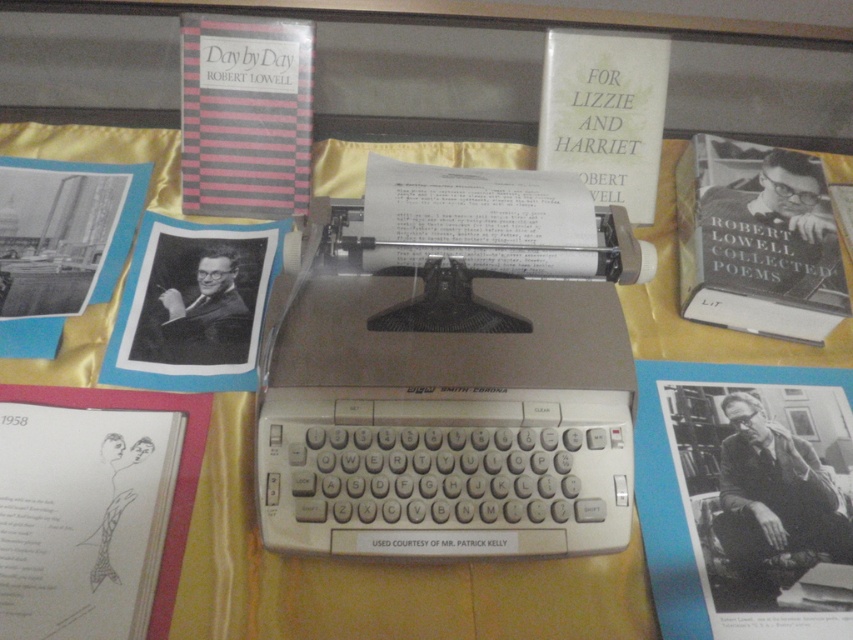
Question: Which of the following is the farthest from the observer?

Choices:
 (A) (213, 369)
 (B) (39, 579)
 (C) (189, 93)
 (D) (763, 634)

Answer: (C)

Question: Is black paper book at center wider than black paper at left?

Choices:
 (A) yes
 (B) no

Answer: (A)

Question: Does black paper book at center have a larger size compared to black paper sketch at lower left?

Choices:
 (A) yes
 (B) no

Answer: (A)

Question: Which object appears farthest from the camera in this image?

Choices:
 (A) black paper at left
 (B) hardcover book at right
 (C) pink striped book at upper left

Answer: (C)

Question: Which point appears closest to the camera in this image?

Choices:
 (A) (801, 600)
 (B) (167, 220)
 (C) (810, 192)

Answer: (A)

Question: Is hardcover book at right smaller than black paper at left?

Choices:
 (A) yes
 (B) no

Answer: (B)